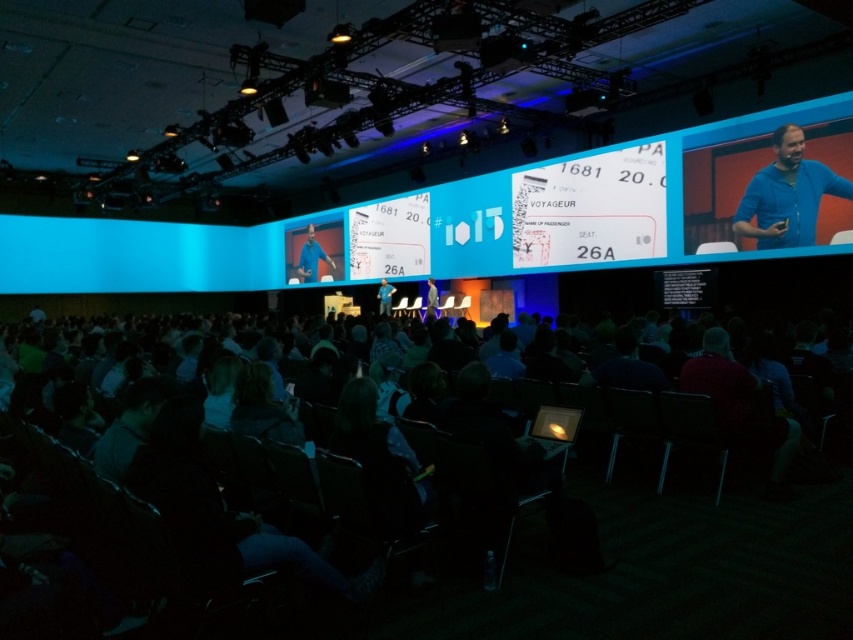
Question: Where is blue cotton shirt at upper right located in relation to blue fabric shirt at center in the image?

Choices:
 (A) right
 (B) left

Answer: (A)

Question: Which object is positioned farthest from the blue shirt at center?

Choices:
 (A) blue fabric shirt at center
 (B) blue cotton shirt at upper right

Answer: (B)

Question: Which object is positioned farthest from the blue fabric shirt at center?

Choices:
 (A) blue cotton shirt at upper right
 (B) blue shirt at center

Answer: (A)

Question: Is blue cotton shirt at upper right to the right of blue fabric shirt at center from the viewer's perspective?

Choices:
 (A) yes
 (B) no

Answer: (A)

Question: Estimate the real-world distances between objects in this image. Which object is farther from the blue cotton shirt at upper right?

Choices:
 (A) blue fabric shirt at center
 (B) blue shirt at center

Answer: (A)

Question: Is blue cotton shirt at upper right thinner than light blue fabric suit at center?

Choices:
 (A) yes
 (B) no

Answer: (B)